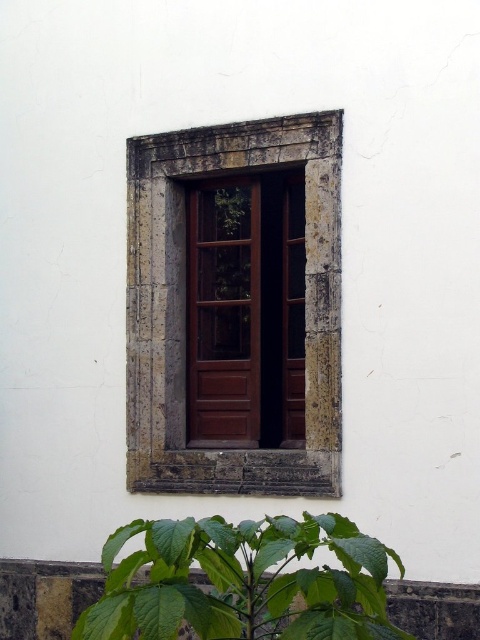
What do you see at coordinates (186, 305) in the screenshot? This screenshot has width=480, height=640. I see `stone textured window frame at center` at bounding box center [186, 305].

Consider the image. How far apart are stone textured window frame at center and brown wooden door at center?

stone textured window frame at center is 15.71 inches away from brown wooden door at center.

Which is in front, point (129, 198) or point (269, 228)?

Point (129, 198)

Find the location of a particular element. The image size is (480, 640). stone textured window frame at center is located at coordinates (186, 305).

Who is more distant from viewer, (132, 246) or (95, 616)?

Point (132, 246)

Is point (222, 468) farther from camera compared to point (237, 580)?

Yes, point (222, 468) is farther from viewer.

You are a GUI agent. You are given a task and a screenshot of the screen. Output one action in this format:
    pyautogui.click(x=<x>, y=<y>)
    Task: Click on the stone textured window frame at center
    
    Given the screenshot: What is the action you would take?
    pyautogui.click(x=186, y=305)

Which is below, green leafy plant at lower center or brown wooden door at center?

green leafy plant at lower center is below.

Between point (152, 620) and point (253, 224), which one is positioned behind?

Point (253, 224)

Image resolution: width=480 pixels, height=640 pixels. Describe the element at coordinates (243, 580) in the screenshot. I see `green leafy plant at lower center` at that location.

Locate an element on the screen. This screenshot has height=640, width=480. green leafy plant at lower center is located at coordinates (243, 580).